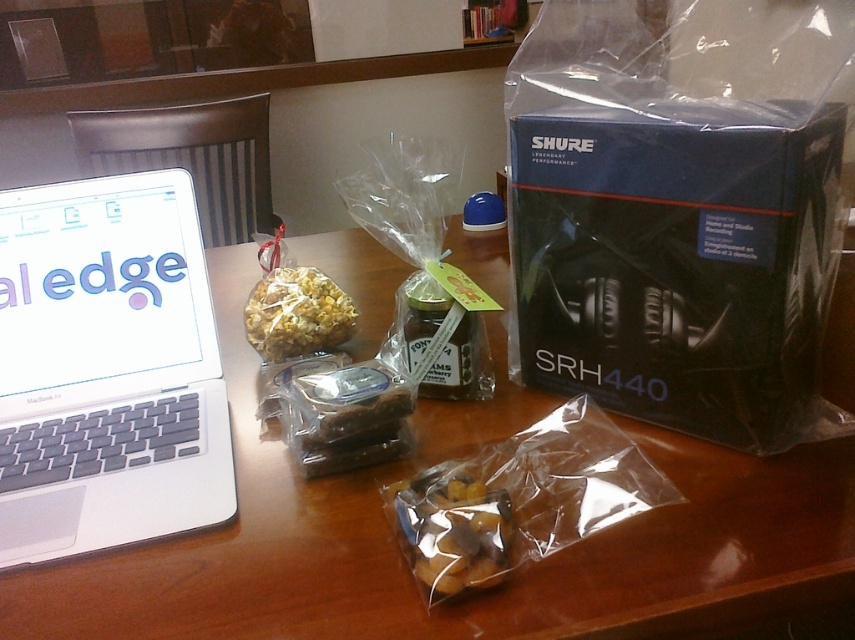
Is wooden table at center further to the viewer compared to silver metallic laptop at left?

No, wooden table at center is closer to the viewer.

Locate an element on the screen. This screenshot has width=855, height=640. wooden table at center is located at coordinates (404, 564).

The width and height of the screenshot is (855, 640). What are the coordinates of `wooden table at center` in the screenshot? It's located at (404, 564).

I want to click on wooden table at center, so click(x=404, y=564).

Based on the photo, who is shorter, wooden table at center or translucent plastic bag of snacks at center?

Standing shorter between the two is translucent plastic bag of snacks at center.

Between wooden table at center and translucent plastic bag of snacks at center, which one has more height?

With more height is wooden table at center.

Describe the element at coordinates (404, 564) in the screenshot. I see `wooden table at center` at that location.

At what (x,y) coordinates should I click in order to perform the action: click on wooden table at center. Please return your answer as a coordinate pair (x, y). Looking at the image, I should click on (404, 564).

Between wooden table at center and blue matte box at right, which one is positioned lower?

wooden table at center is below.

The width and height of the screenshot is (855, 640). What are the coordinates of `wooden table at center` in the screenshot? It's located at (404, 564).

Where is `wooden table at center`? The width and height of the screenshot is (855, 640). wooden table at center is located at coordinates (404, 564).